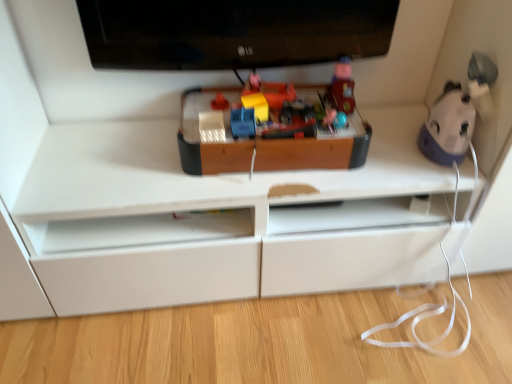
Question: Choose the correct answer: Is wooden toy at center, the 3th toy positioned from the right, inside matte plastic toy at center, which appears as the first toy when viewed from the left, or outside it?

Choices:
 (A) inside
 (B) outside

Answer: (B)

Question: In the image, is wooden toy at center, placed as the fourth toy when sorted from left to right, positioned in front of or behind matte plastic toy at center, which appears as the first toy when viewed from the left?

Choices:
 (A) front
 (B) behind

Answer: (A)

Question: Which of these objects is positioned farthest from the black glossy television at upper center?

Choices:
 (A) wooden toy at center, the 3th toy positioned from the right
 (B) matte plastic toy at center, which ranks as the sixth toy in right-to-left order
 (C) matte plastic toy at upper center, the 5th toy viewed from the left
 (D) blue plastic toy at right, the 6th toy when ordered from left to right
 (E) matte blue plastic toy car at center, arranged as the 2th toy when viewed from the left

Answer: (D)

Question: Based on their relative distances, which object is farther from the yellow plastic toy at center, the third toy positioned from the left?

Choices:
 (A) blue plastic toy at right, placed as the first toy when sorted from right to left
 (B) matte blue plastic toy car at center, the fifth toy from the right
 (C) wooden toy at center, placed as the fourth toy when sorted from left to right
 (D) matte plastic toy at center, which ranks as the sixth toy in right-to-left order
 (E) black glossy television at upper center

Answer: (A)